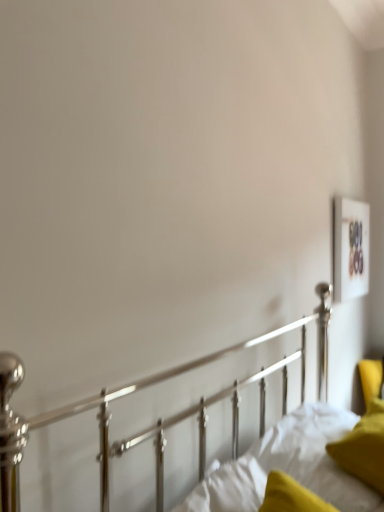
Question: From the image's perspective, does velvet yellow pillow at lower right appear higher than white soft mattress at lower right?

Choices:
 (A) yes
 (B) no

Answer: (A)

Question: Can you confirm if velvet yellow pillow at lower right is positioned to the left of white soft mattress at lower right?

Choices:
 (A) yes
 (B) no

Answer: (B)

Question: Is velvet yellow pillow at lower right thinner than white soft mattress at lower right?

Choices:
 (A) no
 (B) yes

Answer: (B)

Question: Could you tell me if velvet yellow pillow at lower right is facing white soft mattress at lower right?

Choices:
 (A) no
 (B) yes

Answer: (B)

Question: From the image's perspective, would you say velvet yellow pillow at lower right is shown under white soft mattress at lower right?

Choices:
 (A) yes
 (B) no

Answer: (B)

Question: Can you confirm if velvet yellow pillow at lower right is positioned to the right of white soft mattress at lower right?

Choices:
 (A) no
 (B) yes

Answer: (B)

Question: Does wooden frame at upper right have a greater height compared to velvet yellow pillow at lower right?

Choices:
 (A) no
 (B) yes

Answer: (B)

Question: From a real-world perspective, does wooden frame at upper right stand above velvet yellow pillow at lower right?

Choices:
 (A) yes
 (B) no

Answer: (A)

Question: From the image's perspective, would you say wooden frame at upper right is positioned over velvet yellow pillow at lower right?

Choices:
 (A) no
 (B) yes

Answer: (B)

Question: Are wooden frame at upper right and velvet yellow pillow at lower right beside each other?

Choices:
 (A) no
 (B) yes

Answer: (A)

Question: Can you confirm if wooden frame at upper right is wider than velvet yellow pillow at lower right?

Choices:
 (A) no
 (B) yes

Answer: (A)

Question: Considering the relative positions of wooden frame at upper right and velvet yellow pillow at lower right in the image provided, is wooden frame at upper right to the right of velvet yellow pillow at lower right from the viewer's perspective?

Choices:
 (A) yes
 (B) no

Answer: (A)

Question: Does white soft mattress at lower right turn towards velvet yellow pillow at lower right?

Choices:
 (A) yes
 (B) no

Answer: (A)